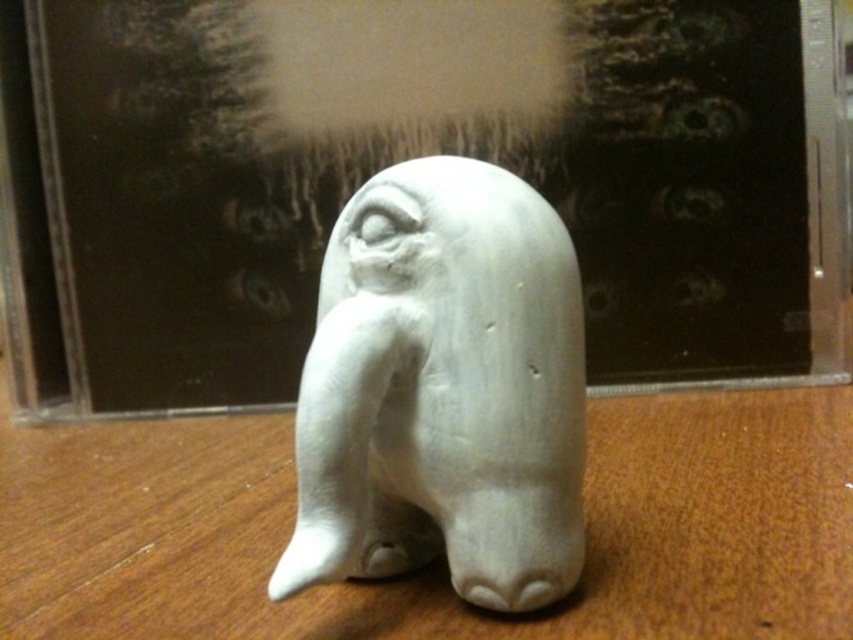
Is wooden table at center positioned in front of white matte elephant at center?

Yes, wooden table at center is closer to the viewer.

Does point (108, 506) come behind point (410, 163)?

That is True.

Where is `wooden table at center`? Image resolution: width=853 pixels, height=640 pixels. wooden table at center is located at coordinates (440, 560).